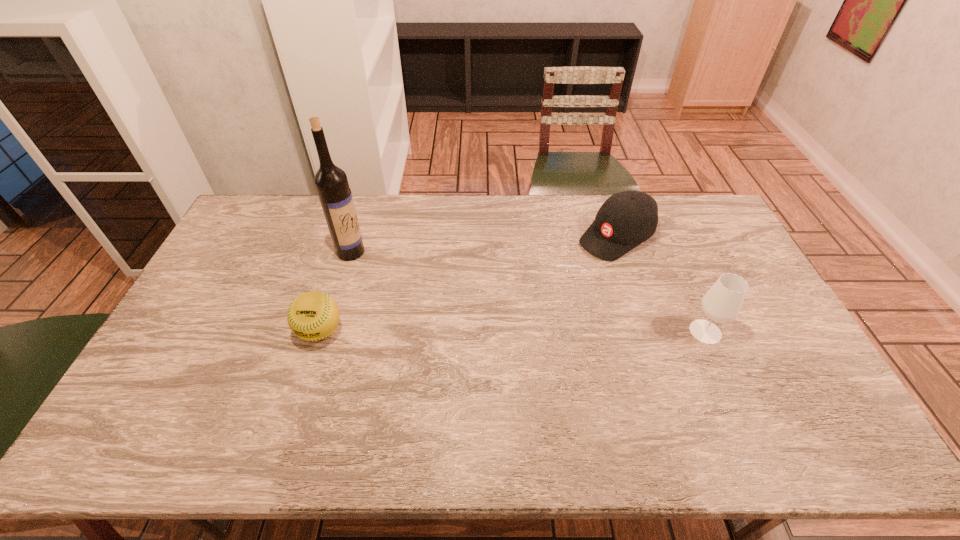
You are a GUI agent. You are given a task and a screenshot of the screen. Output one action in this format:
    pyautogui.click(x=<x>, y=<y>)
    Task: Click on the softball
    The height and width of the screenshot is (540, 960).
    Given the screenshot: What is the action you would take?
    pyautogui.click(x=312, y=316)

Where is `the second tallest object`? This screenshot has height=540, width=960. the second tallest object is located at coordinates (722, 303).

Identify the location of baseball cap. (626, 219).

Locate an element on the screen. The height and width of the screenshot is (540, 960). wine bottle is located at coordinates click(331, 182).

The width and height of the screenshot is (960, 540). Identify the location of free space located 0.110m on the logo side of the softball. (303, 386).

Locate an element on the screen. vacant space positioned on the right of the glass is located at coordinates (763, 332).

Locate an element on the screen. This screenshot has width=960, height=540. free space located with a logo on the front of the baseball cap is located at coordinates (563, 271).

Find the location of a particular element. Image resolution: width=960 pixels, height=540 pixels. vacant space located with a logo on the front of the baseball cap is located at coordinates (520, 299).

What are the coordinates of `free space located 0.390m with a logo on the front of the baseball cap` in the screenshot? It's located at (506, 308).

Locate an element on the screen. The height and width of the screenshot is (540, 960). vacant space located 0.110m on the label of the wine bottle is located at coordinates (384, 271).